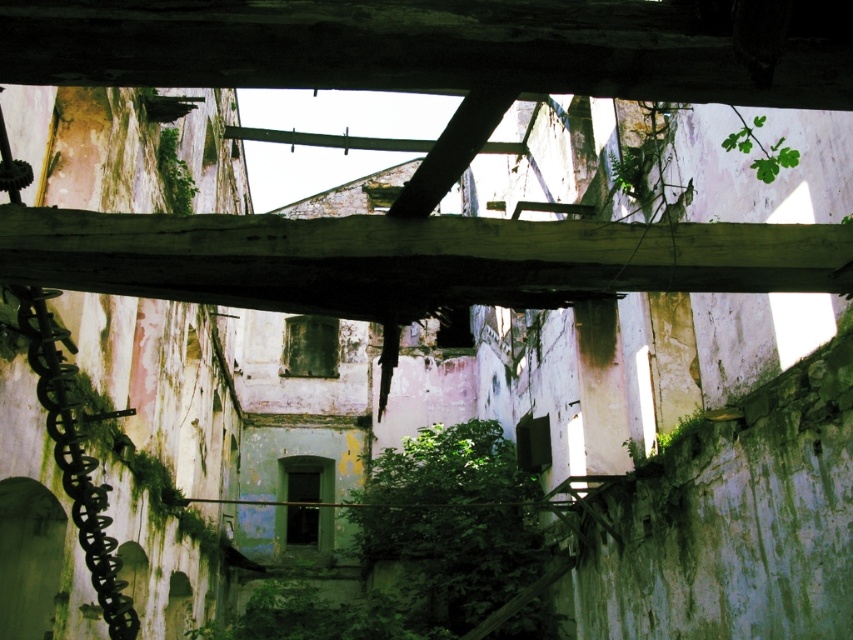
You are an explorer navigating through the ruins of an abandoned building. You notice a green wood beam at center and a green leafy plant at center. Which object takes up more space in the scene?

The green wood beam at center is bigger than the green leafy plant at center, so it takes up more space in the scene.

You are a construction worker assessing the safety of this abandoned building. You need to reach the green wood beam at center to inspect its structural integrity. Given that the beam is 14.48 meters away from your current position, can you safely walk towards it without any equipment?

The green wood beam at center is 14.48 meters away from the camera. However, the scene describes a collapsed structure with exposed beams and decayed walls, which may pose safety risks such as unstable floors or falling debris. Walking towards the beam without proper equipment is not advisable due to potential hazards.